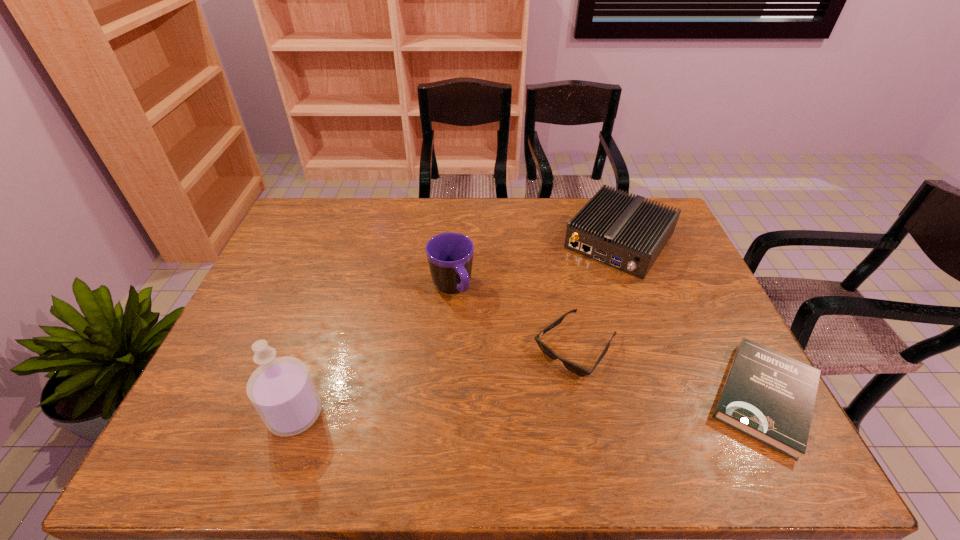
Image resolution: width=960 pixels, height=540 pixels. Identify the location of free spot between the third tallest object and the second object from left to right. (536, 265).

Locate an element on the screen. The image size is (960, 540). free area in between the third tallest object and the leftmost object is located at coordinates coord(457,327).

Find the location of `free spot between the third tallest object and the mug`. free spot between the third tallest object and the mug is located at coordinates click(x=536, y=265).

You are a GUI agent. You are given a task and a screenshot of the screen. Output one action in this format:
    pyautogui.click(x=<x>, y=<y>)
    Task: Click on the vacant area between the router and the mug
    
    Given the screenshot: What is the action you would take?
    pyautogui.click(x=536, y=265)

Locate an element on the screen. This screenshot has width=960, height=540. vacant space in between the book and the router is located at coordinates (692, 319).

Where is `free spot between the router and the leftmost object`? This screenshot has width=960, height=540. free spot between the router and the leftmost object is located at coordinates (457, 327).

Where is `free space between the perfume and the second tallest object`? free space between the perfume and the second tallest object is located at coordinates (373, 351).

I want to click on free area in between the third tallest object and the second tallest object, so click(536, 265).

Identify the location of the fourth closest object to the mug. The width and height of the screenshot is (960, 540). (768, 396).

This screenshot has height=540, width=960. I want to click on the fourth closest object relative to the second object from left to right, so click(768, 396).